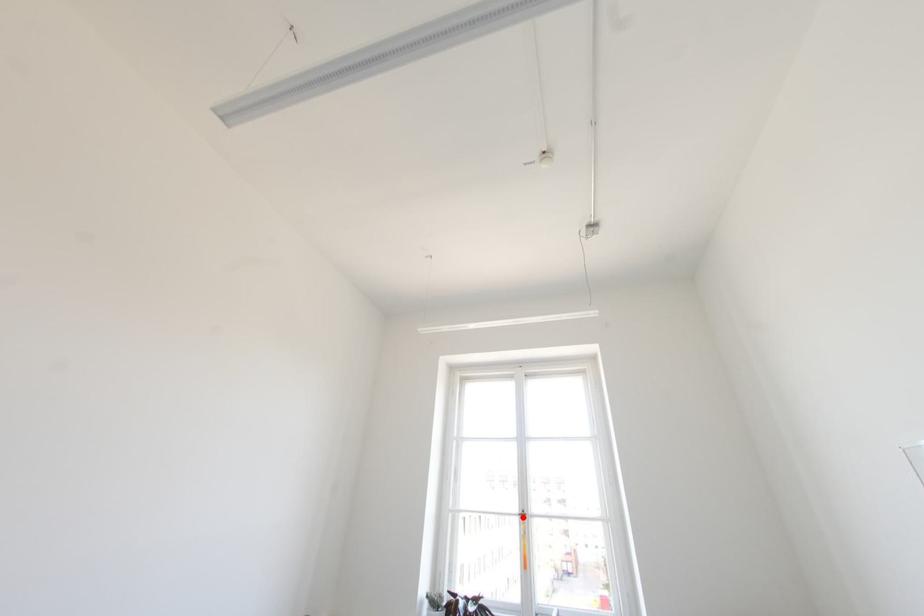
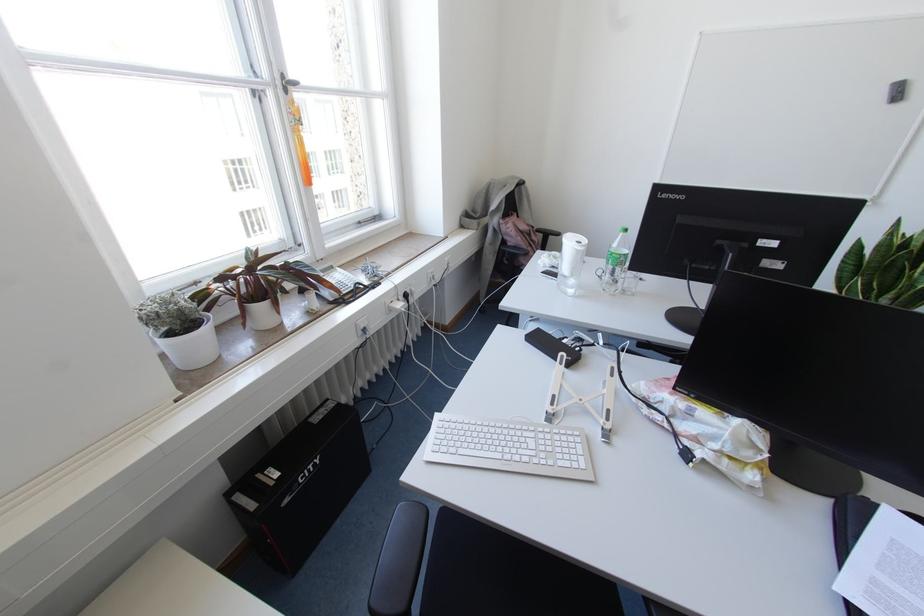
Question: I am providing you with two images of the same scene from different viewpoints. In image1, a red point is highlighted. Considering the same 3D point in image2, which of the following is correct?

Choices:
 (A) It is closer
 (B) It is farther

Answer: (A)